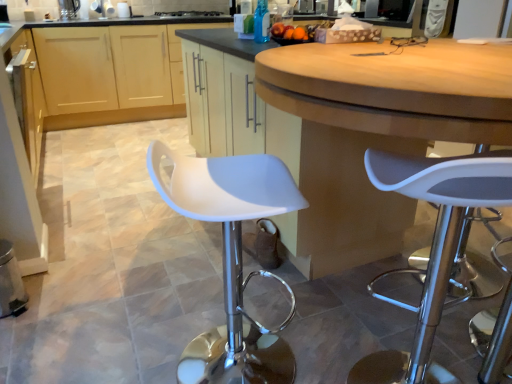
At what (x,y) coordinates should I click in order to perform the action: click on white plastic stool at center. Please return your answer as a coordinate pair (x, y). Looking at the image, I should click on (231, 259).

Identify the location of matte white cabinet at center, marked as the second cabinetry in a back-to-front arrangement. The width and height of the screenshot is (512, 384). (365, 131).

What are the coordinates of `white plastic stool at center` in the screenshot? It's located at (231, 259).

Is matte wood cabinets at center, the second cabinetry in the front-to-back sequence, positioned beyond the bounds of white plastic stool at center?

matte wood cabinets at center, the second cabinetry in the front-to-back sequence, is positioned outside white plastic stool at center.

Which of these two, matte wood cabinets at center, the 1th cabinetry from the back, or white plastic stool at center, stands shorter?

white plastic stool at center.

Where is `stool below the matte wood cabinets at center, the second cabinetry in the front-to-back sequence (from the image's perspective)`? stool below the matte wood cabinets at center, the second cabinetry in the front-to-back sequence (from the image's perspective) is located at coordinates (432, 247).

Considering the relative positions of matte wood cabinets at center, the 1th cabinetry from the back, and white plastic stool at center in the image provided, is matte wood cabinets at center, the 1th cabinetry from the back, to the right of white plastic stool at center from the viewer's perspective?

No.

Is matte wood cabinets at center, the second cabinetry in the front-to-back sequence, completely or partially outside of matte white cabinet at center, the 1th cabinetry viewed from the front?

matte wood cabinets at center, the second cabinetry in the front-to-back sequence, lies outside matte white cabinet at center, the 1th cabinetry viewed from the front,'s area.

Is matte wood cabinets at center, the 1th cabinetry from the back, closer to the viewer compared to matte white cabinet at center, the 1th cabinetry viewed from the front?

No, it is behind matte white cabinet at center, the 1th cabinetry viewed from the front.

Does matte wood cabinets at center, the 1th cabinetry from the back, appear on the left side of matte white cabinet at center, marked as the second cabinetry in a back-to-front arrangement?

Yes, matte wood cabinets at center, the 1th cabinetry from the back, is to the left of matte white cabinet at center, marked as the second cabinetry in a back-to-front arrangement.

Which point is more distant from viewer, (x=132, y=63) or (x=399, y=204)?

The point (x=132, y=63) is behind.

Is blue glass bottle at upper center thinner than white plastic stool at center?

Correct, the width of blue glass bottle at upper center is less than that of white plastic stool at center.

From a real-world perspective, does blue glass bottle at upper center sit lower than white plastic stool at center?

Incorrect, from a real-world perspective, blue glass bottle at upper center is higher than white plastic stool at center.

Would you consider blue glass bottle at upper center to be distant from white plastic stool at center?

Indeed, blue glass bottle at upper center is not near white plastic stool at center.

Which is less distant, (266,39) or (233,275)?

The point (233,275) is closer to the camera.

From a real-world perspective, relative to blue glass bottle at upper center, is matte white cabinet at center, marked as the second cabinetry in a back-to-front arrangement, vertically above or below?

From a real-world perspective, matte white cabinet at center, marked as the second cabinetry in a back-to-front arrangement, is physically below blue glass bottle at upper center.

From their relative heights in the image, would you say matte white cabinet at center, the 1th cabinetry viewed from the front, is taller or shorter than blue glass bottle at upper center?

Clearly, matte white cabinet at center, the 1th cabinetry viewed from the front, is taller compared to blue glass bottle at upper center.

Are matte white cabinet at center, the 1th cabinetry viewed from the front, and blue glass bottle at upper center making contact?

No, matte white cabinet at center, the 1th cabinetry viewed from the front, is not beside blue glass bottle at upper center.

Which is in front, point (281, 130) or point (264, 2)?

The point (281, 130) is more forward.

You are a GUI agent. You are given a task and a screenshot of the screen. Output one action in this format:
    pyautogui.click(x=<x>, y=<y>)
    Task: Click on the chair on the right of the matte wood cabinets at center, the second cabinetry in the front-to-back sequence
    The width and height of the screenshot is (512, 384).
    Given the screenshot: What is the action you would take?
    pyautogui.click(x=231, y=259)

Measure the distance between white plastic stool at center and matte wood cabinets at center, the second cabinetry in the front-to-back sequence.

white plastic stool at center and matte wood cabinets at center, the second cabinetry in the front-to-back sequence, are 8.80 feet apart from each other.

Is white plastic stool at center looking in the opposite direction of matte wood cabinets at center, the 1th cabinetry from the back?

white plastic stool at center does not have its back to matte wood cabinets at center, the 1th cabinetry from the back.

Consider the image. Which of these two, white plastic stool at center or matte wood cabinets at center, the second cabinetry in the front-to-back sequence, stands shorter?

Standing shorter between the two is white plastic stool at center.

At what (x,y) coordinates should I click in order to perform the action: click on stool in front of the matte white cabinet at center, the 1th cabinetry viewed from the front. Please return your answer as a coordinate pair (x, y). The width and height of the screenshot is (512, 384). Looking at the image, I should click on (432, 247).

Is white plastic stool at center not near matte white cabinet at center, marked as the second cabinetry in a back-to-front arrangement?

Actually, white plastic stool at center and matte white cabinet at center, marked as the second cabinetry in a back-to-front arrangement, are a little close together.

From the image's perspective, is white plastic stool at center located above matte white cabinet at center, the 1th cabinetry viewed from the front?

No.

From a real-world perspective, between white plastic stool at center and matte white cabinet at center, marked as the second cabinetry in a back-to-front arrangement, who is vertically higher?

matte white cabinet at center, marked as the second cabinetry in a back-to-front arrangement.

Based on their sizes in the image, would you say blue glass bottle at upper center is bigger or smaller than matte white cabinet at center, marked as the second cabinetry in a back-to-front arrangement?

In the image, blue glass bottle at upper center appears to be smaller than matte white cabinet at center, marked as the second cabinetry in a back-to-front arrangement.

Considering the sizes of objects blue glass bottle at upper center and matte white cabinet at center, the 1th cabinetry viewed from the front, in the image provided, who is taller, blue glass bottle at upper center or matte white cabinet at center, the 1th cabinetry viewed from the front,?

matte white cabinet at center, the 1th cabinetry viewed from the front.

Can you tell me how much blue glass bottle at upper center and matte white cabinet at center, marked as the second cabinetry in a back-to-front arrangement, differ in facing direction?

The angle between the facing direction of blue glass bottle at upper center and the facing direction of matte white cabinet at center, marked as the second cabinetry in a back-to-front arrangement, is 44.4 degrees.

Measure the distance from blue glass bottle at upper center to matte white cabinet at center, the 1th cabinetry viewed from the front.

They are 24.50 inches apart.

The height and width of the screenshot is (384, 512). Identify the location of the 2nd cabinetry above when counting from the white plastic stool at center (from the image's perspective). (113, 74).

Where is `cabinetry located on the left of matte white cabinet at center, the 1th cabinetry viewed from the front`? The width and height of the screenshot is (512, 384). cabinetry located on the left of matte white cabinet at center, the 1th cabinetry viewed from the front is located at coordinates (113, 74).

Looking at the image, which one is located closer to white plastic stool at center, white plastic stool at center or matte white cabinet at center, the 1th cabinetry viewed from the front?

matte white cabinet at center, the 1th cabinetry viewed from the front.

Which object lies nearer to the anchor point matte white cabinet at center, the 1th cabinetry viewed from the front, white plastic stool at center or white plastic stool at center?

Based on the image, white plastic stool at center appears to be nearer to matte white cabinet at center, the 1th cabinetry viewed from the front.

From the image, which object appears to be nearer to matte wood cabinets at center, the second cabinetry in the front-to-back sequence, blue glass bottle at upper center or black glass stove at upper center?

black glass stove at upper center.

Looking at the image, which one is located closer to white plastic stool at center, blue glass bottle at upper center or matte white cabinet at center, marked as the second cabinetry in a back-to-front arrangement?

Based on the image, matte white cabinet at center, marked as the second cabinetry in a back-to-front arrangement, appears to be nearer to white plastic stool at center.

Consider the image. Which object lies nearer to the anchor point white plastic stool at center, white plastic stool at center or matte wood cabinets at center, the second cabinetry in the front-to-back sequence?

Among the two, white plastic stool at center is located nearer to white plastic stool at center.

Looking at the image, which one is located further to matte white cabinet at center, the 1th cabinetry viewed from the front, black glass stove at upper center or matte wood cabinets at center, the second cabinetry in the front-to-back sequence?

The object further to matte white cabinet at center, the 1th cabinetry viewed from the front, is black glass stove at upper center.

Which object lies nearer to the anchor point white plastic stool at center, matte wood cabinets at center, the second cabinetry in the front-to-back sequence, or white plastic stool at center?

white plastic stool at center.

Considering their positions, is matte white cabinet at center, marked as the second cabinetry in a back-to-front arrangement, positioned closer to matte wood cabinets at center, the second cabinetry in the front-to-back sequence, than blue glass bottle at upper center?

matte white cabinet at center, marked as the second cabinetry in a back-to-front arrangement, lies closer to matte wood cabinets at center, the second cabinetry in the front-to-back sequence, than the other object.

The width and height of the screenshot is (512, 384). In order to click on bottle between matte white cabinet at center, the 1th cabinetry viewed from the front, and matte wood cabinets at center, the second cabinetry in the front-to-back sequence, in the front-back direction in this screenshot , I will do coord(261,22).

At what (x,y) coordinates should I click in order to perform the action: click on bottle between white plastic stool at center and matte wood cabinets at center, the 1th cabinetry from the back, from front to back. Please return your answer as a coordinate pair (x, y). The height and width of the screenshot is (384, 512). Looking at the image, I should click on (261, 22).

Locate an element on the screen. bottle located between matte white cabinet at center, marked as the second cabinetry in a back-to-front arrangement, and black glass stove at upper center in the depth direction is located at coordinates (261, 22).

Identify the location of chair between white plastic stool at center and black glass stove at upper center along the z-axis. The image size is (512, 384). (231, 259).